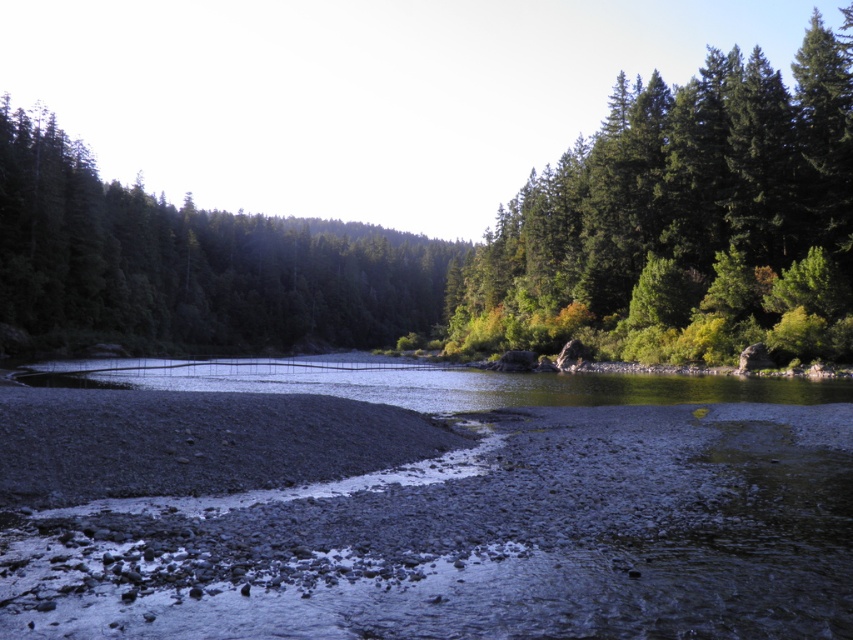
Question: Is gray gravel riverbed at center above gray gravelly mud at lower left?

Choices:
 (A) no
 (B) yes

Answer: (A)

Question: Which object appears closest to the camera in this image?

Choices:
 (A) green matte tree at upper right
 (B) gray gravel riverbed at center
 (C) gray gravelly mud at lower left

Answer: (B)

Question: Which object appears closest to the camera in this image?

Choices:
 (A) green matte tree at upper right
 (B) green matte forest at center
 (C) green matte tree at upper center

Answer: (A)

Question: Estimate the real-world distances between objects in this image. Which object is farther from the green matte tree at upper right?

Choices:
 (A) green matte forest at center
 (B) gray gravel riverbed at center
 (C) green matte tree at upper center
 (D) gray gravelly mud at lower left

Answer: (D)

Question: Is gray gravel riverbed at center above gray gravelly mud at lower left?

Choices:
 (A) no
 (B) yes

Answer: (A)

Question: Is gray gravel riverbed at center smaller than green matte tree at upper right?

Choices:
 (A) yes
 (B) no

Answer: (A)